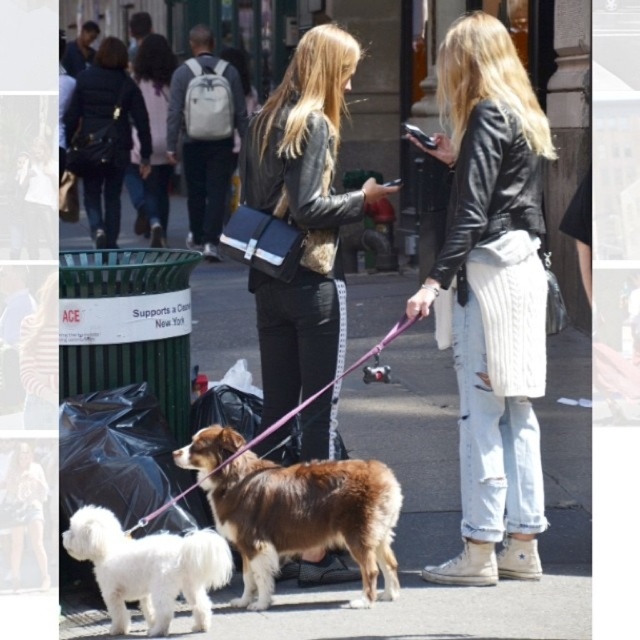
Who is more distant from viewer, (401, 458) or (490, 476)?

The point (401, 458) is behind.

Is smooth asphalt pavement at center above black leather jacket at center?

Correct, smooth asphalt pavement at center is located above black leather jacket at center.

Between point (416, 353) and point (525, 109), which one is positioned behind?

The point (416, 353) is behind.

Where is `smooth asphalt pavement at center`? smooth asphalt pavement at center is located at coordinates (452, 508).

Is brown furry dog at center to the right of purple fabric leash at center from the viewer's perspective?

Indeed, brown furry dog at center is positioned on the right side of purple fabric leash at center.

From the picture: Can you confirm if brown furry dog at center is bigger than purple fabric leash at center?

Yes.

The height and width of the screenshot is (640, 640). Identify the location of brown furry dog at center. (296, 512).

Image resolution: width=640 pixels, height=640 pixels. Find the location of `brown furry dog at center`. brown furry dog at center is located at coordinates (296, 512).

Can you confirm if smooth asphalt pavement at center is thinner than black quilted jacket at upper left?

In fact, smooth asphalt pavement at center might be wider than black quilted jacket at upper left.

Can you confirm if smooth asphalt pavement at center is positioned to the left of black quilted jacket at upper left?

No, smooth asphalt pavement at center is not to the left of black quilted jacket at upper left.

Describe the element at coordinates (452, 508) in the screenshot. I see `smooth asphalt pavement at center` at that location.

I want to click on smooth asphalt pavement at center, so click(452, 508).